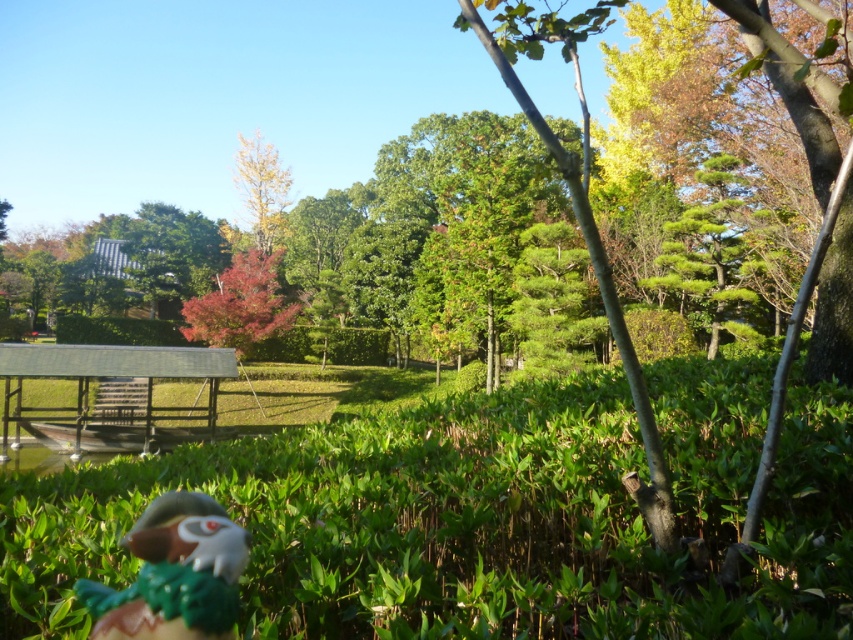
Question: Can you confirm if shiny plastic bird at lower left is wider than vivid red leaves at center?

Choices:
 (A) yes
 (B) no

Answer: (B)

Question: Is shiny plastic bird at lower left thinner than vivid red leaves at center?

Choices:
 (A) no
 (B) yes

Answer: (B)

Question: Which point is closer to the camera?

Choices:
 (A) shiny plastic bird at lower left
 (B) vivid red leaves at center

Answer: (A)

Question: Is shiny plastic bird at lower left to the right of vivid red leaves at center from the viewer's perspective?

Choices:
 (A) no
 (B) yes

Answer: (B)